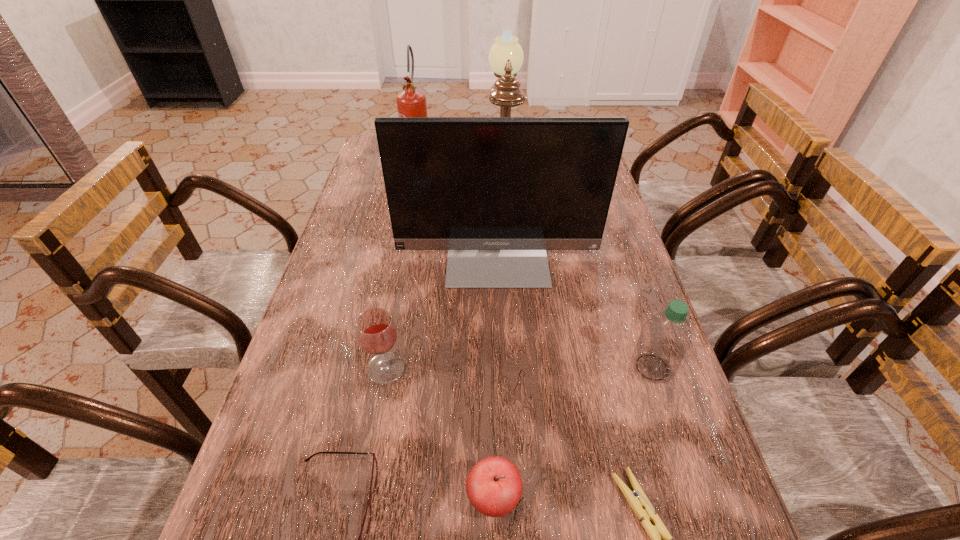
At what (x,y) coordinates should I click in order to perform the action: click on vacant area at the right edge. Please return your answer as a coordinate pair (x, y). The image size is (960, 540). Looking at the image, I should click on (626, 359).

I want to click on free point between the water bottle and the third shortest object, so click(x=573, y=433).

Image resolution: width=960 pixels, height=540 pixels. Find the location of `vacant area that lies between the fire extinguisher and the apple`. vacant area that lies between the fire extinguisher and the apple is located at coordinates (457, 334).

I want to click on vacant region between the oil lamp and the fourth shortest object, so click(x=444, y=266).

Where is `object that is the seventh closest to the rightmost object`? object that is the seventh closest to the rightmost object is located at coordinates pos(411,102).

You are a GUI agent. You are given a task and a screenshot of the screen. Output one action in this format:
    pyautogui.click(x=<x>, y=<y>)
    Task: Click on the sixth closest object to the shortest object
    Image resolution: width=960 pixels, height=540 pixels.
    Given the screenshot: What is the action you would take?
    pyautogui.click(x=506, y=56)

Where is `free space in the image that satisfies the following two spatial constraints: 1. on the front side of the oil lamp; 2. on the left side of the fifth shortest object`? Image resolution: width=960 pixels, height=540 pixels. free space in the image that satisfies the following two spatial constraints: 1. on the front side of the oil lamp; 2. on the left side of the fifth shortest object is located at coordinates (518, 367).

Identify the location of free space that satisfies the following two spatial constraints: 1. on the front side of the fourth tallest object; 2. on the right side of the oil lamp. This screenshot has height=540, width=960. 518,367.

Find the location of a particular element. free region that satisfies the following two spatial constraints: 1. on the back side of the third shortest object; 2. on the left side of the rightmost object is located at coordinates (491, 367).

The width and height of the screenshot is (960, 540). What are the coordinates of `vacant region that satisfies the following two spatial constraints: 1. on the front side of the fourth shortest object; 2. on the left side of the apple` in the screenshot? It's located at point(362,498).